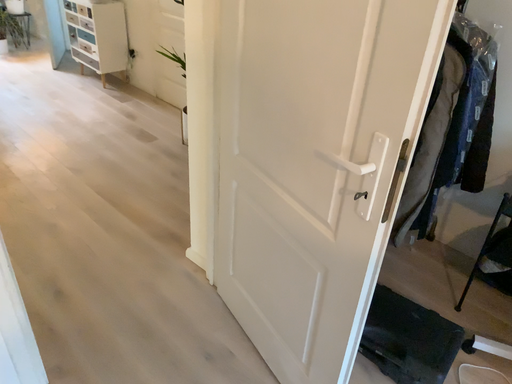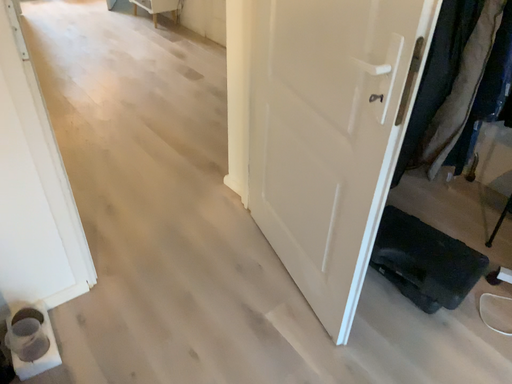
Question: Which way did the camera rotate in the video?

Choices:
 (A) rotated right
 (B) rotated left

Answer: (B)